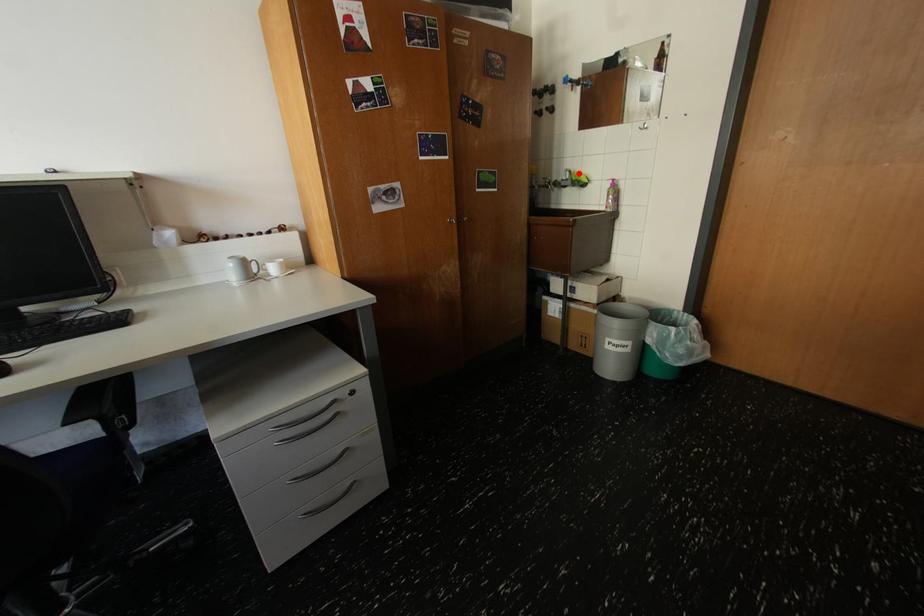
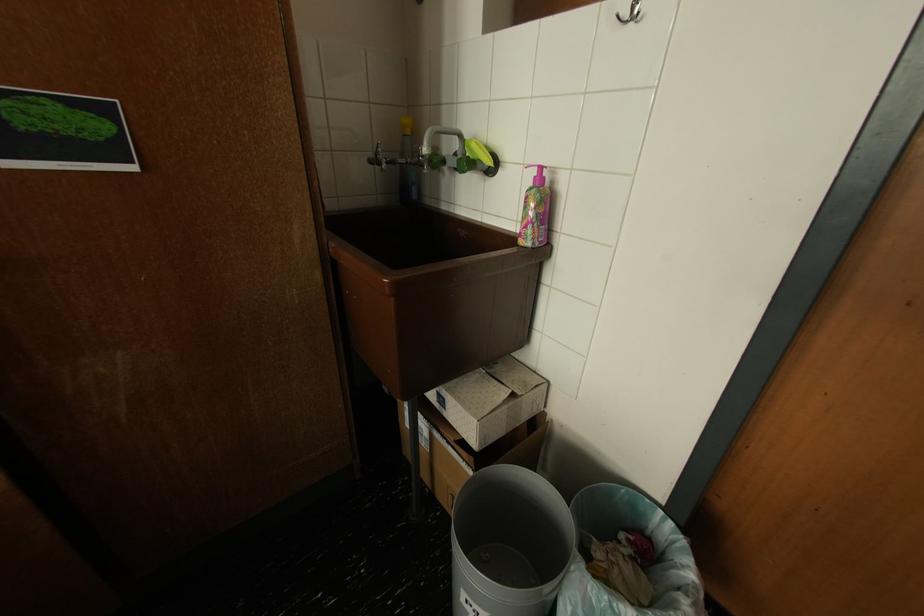
Find the pixel in the second image that matches the highlighted location in the first image.

(468, 138)